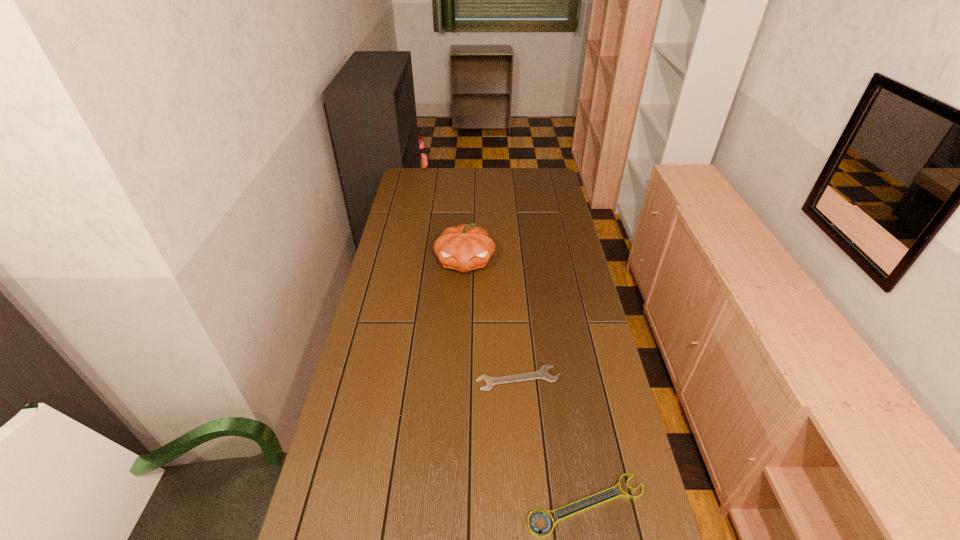
Find the location of a particular element. object that is at the left edge is located at coordinates (422, 161).

Find the location of a particular element. This screenshot has height=540, width=960. object at the far left corner is located at coordinates (422, 161).

In the image, there is a desktop. Find the location of `free space at the left edge`. free space at the left edge is located at coordinates (364, 426).

Identify the location of free spot at the right edge of the desktop. (572, 365).

This screenshot has height=540, width=960. I want to click on free space at the far left corner, so click(403, 185).

The width and height of the screenshot is (960, 540). What are the coordinates of `vacant space in between the farther wrench and the leftmost object` in the screenshot? It's located at (470, 275).

Locate an element on the screen. The height and width of the screenshot is (540, 960). vacant space that is in between the third farthest object and the nearest object is located at coordinates (552, 442).

At what (x,y) coordinates should I click in order to perform the action: click on vacant space in between the root beer and the pumpkin. Please return your answer as a coordinate pair (x, y). Looking at the image, I should click on (444, 217).

Where is `free spot between the nearest object and the leftmost object`? The image size is (960, 540). free spot between the nearest object and the leftmost object is located at coordinates (505, 339).

Where is `free space between the third farthest object and the leftmost object`? This screenshot has width=960, height=540. free space between the third farthest object and the leftmost object is located at coordinates (x=470, y=275).